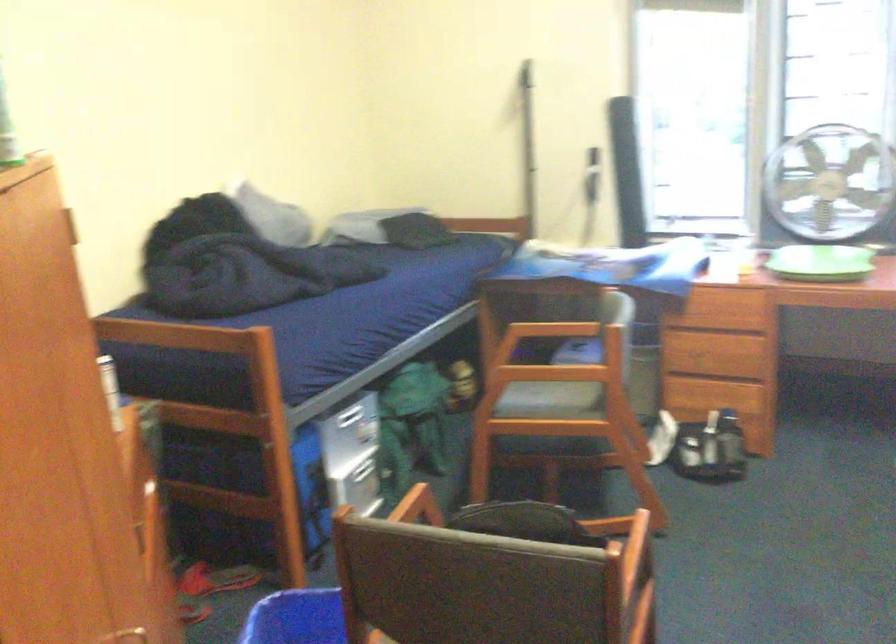
You are a GUI agent. You are given a task and a screenshot of the screen. Output one action in this format:
    pyautogui.click(x=<x>, y=<y>)
    Task: Click on the wooden chair armrest
    
    Given the screenshot: What is the action you would take?
    pyautogui.click(x=418, y=506)